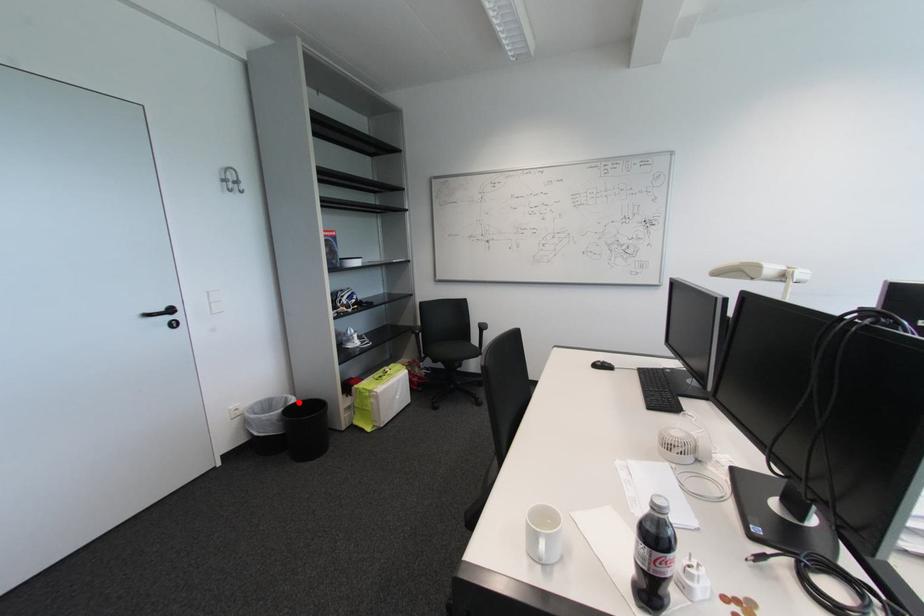
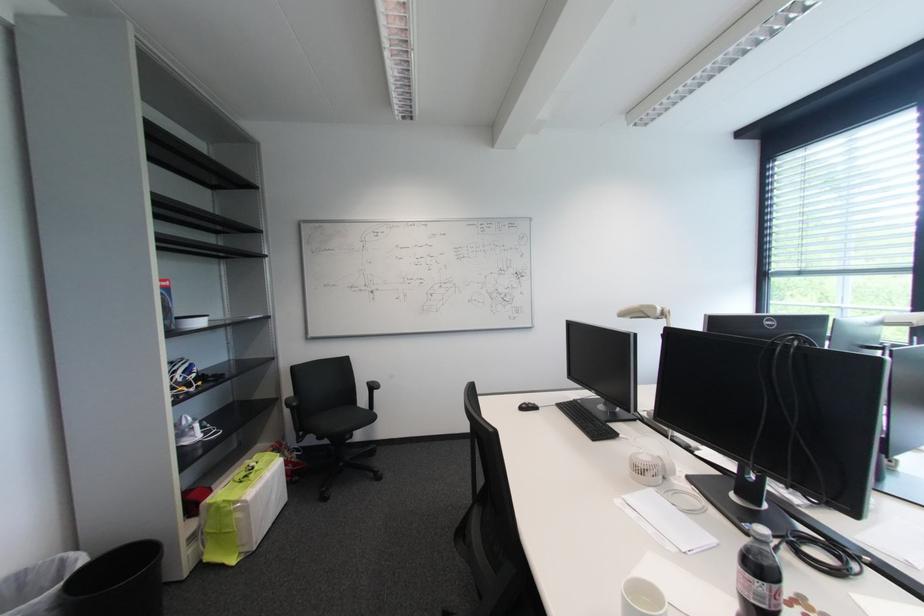
Locate, in the second image, the point that corresponds to the highlighted location in the first image.

(90, 562)